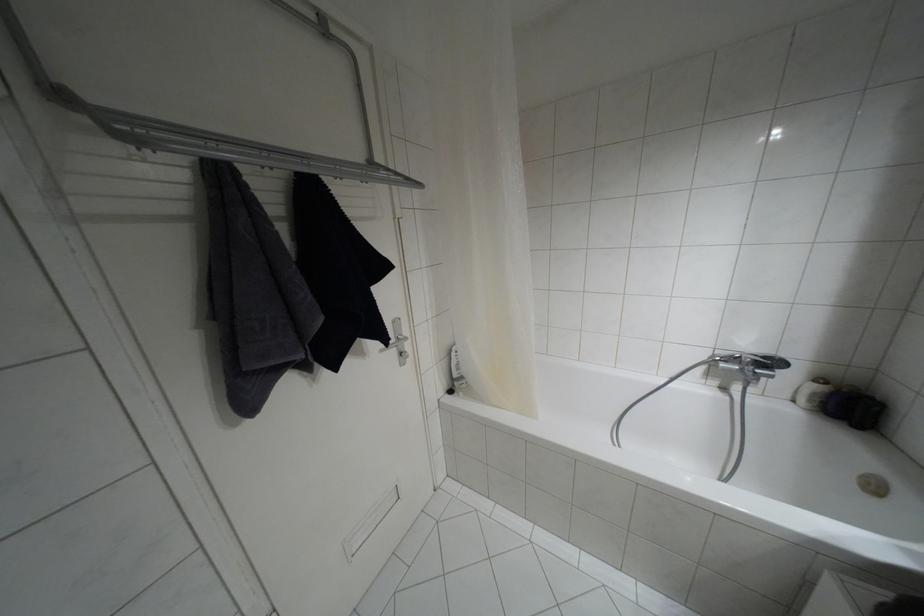
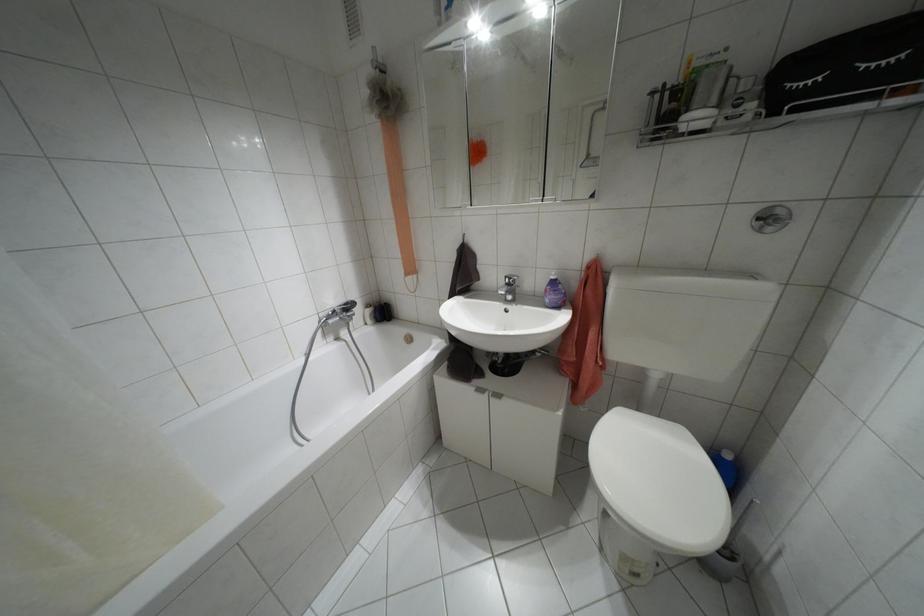
Based on the continuous images, in which direction is the camera rotating?

The camera's rotation is toward right-down.